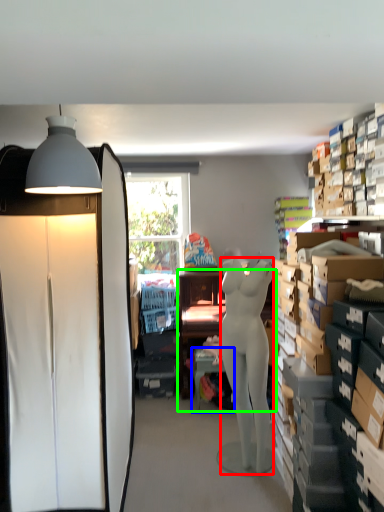
Question: Based on their relative distances, which object is farther from person (highlighted by a red box)? Choose from table (highlighted by a blue box) and desk (highlighted by a green box).

Choices:
 (A) table
 (B) desk

Answer: (B)